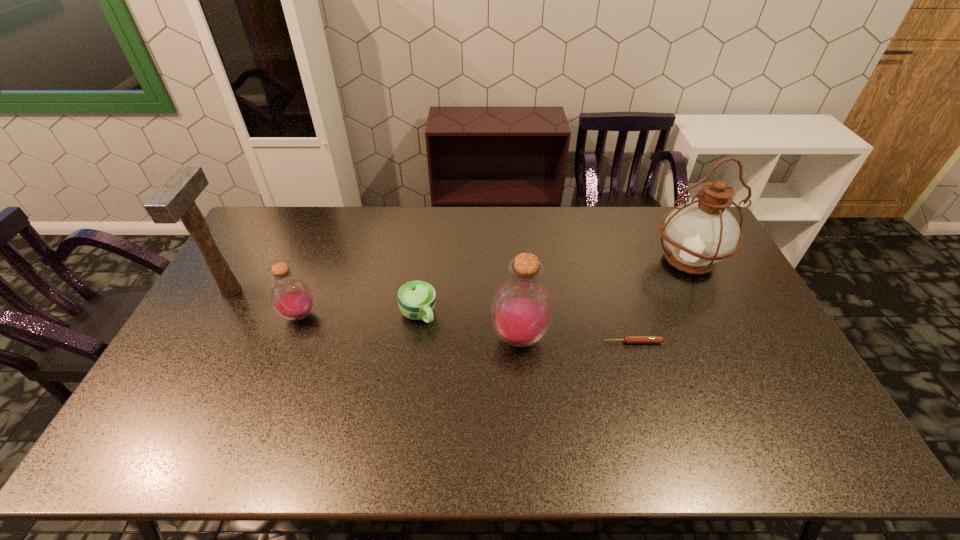
In the image, there is a desktop. Identify the location of free space at the far edge. (436, 239).

Image resolution: width=960 pixels, height=540 pixels. I want to click on vacant region at the near edge, so click(629, 395).

Image resolution: width=960 pixels, height=540 pixels. In the image, there is a desktop. Find the location of `vacant region at the left edge`. vacant region at the left edge is located at coordinates 262,269.

The image size is (960, 540). In the image, there is a desktop. Identify the location of free space at the near left corner. (193, 415).

Identify the location of vacant space at the near right corner of the desktop. The width and height of the screenshot is (960, 540). (754, 397).

Where is `free space that is in between the oil lamp and the cup`? This screenshot has height=540, width=960. free space that is in between the oil lamp and the cup is located at coordinates (553, 287).

You are a GUI agent. You are given a task and a screenshot of the screen. Output one action in this format:
    pyautogui.click(x=<x>, y=<y>)
    Task: Click on the free space that is in between the third object from left to right and the leftmost object
    The image size is (960, 540).
    Given the screenshot: What is the action you would take?
    pyautogui.click(x=324, y=303)

Locate an element on the screen. free space between the leftmost object and the rightmost object is located at coordinates (460, 276).

At what (x,y) coordinates should I click in order to perform the action: click on blank region between the left bottle and the third object from left to right. Please return your answer as a coordinate pair (x, y). Image resolution: width=960 pixels, height=540 pixels. Looking at the image, I should click on (359, 315).

Where is `free spot between the shortest object and the oil lamp`? The height and width of the screenshot is (540, 960). free spot between the shortest object and the oil lamp is located at coordinates (660, 301).